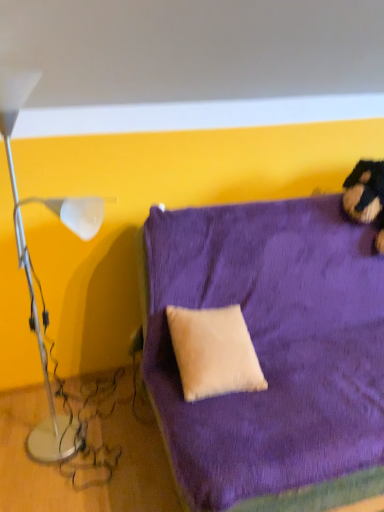
Question: Can beige suede pillow at center be found inside white glossy lamp at left?

Choices:
 (A) no
 (B) yes

Answer: (A)

Question: Can you confirm if white glossy lamp at left is smaller than beige suede pillow at center?

Choices:
 (A) no
 (B) yes

Answer: (A)

Question: Does white glossy lamp at left have a larger size compared to beige suede pillow at center?

Choices:
 (A) yes
 (B) no

Answer: (A)

Question: Does white glossy lamp at left appear on the left side of beige suede pillow at center?

Choices:
 (A) yes
 (B) no

Answer: (A)

Question: Does white glossy lamp at left come in front of beige suede pillow at center?

Choices:
 (A) yes
 (B) no

Answer: (A)

Question: From a real-world perspective, is velvet purple couch at center positioned above or below white glossy lamp at left?

Choices:
 (A) below
 (B) above

Answer: (A)

Question: From the image's perspective, is velvet purple couch at center located above or below white glossy lamp at left?

Choices:
 (A) below
 (B) above

Answer: (A)

Question: Considering the positions of velvet purple couch at center and white glossy lamp at left in the image, is velvet purple couch at center wider or thinner than white glossy lamp at left?

Choices:
 (A) wide
 (B) thin

Answer: (A)

Question: Is velvet purple couch at center inside or outside of white glossy lamp at left?

Choices:
 (A) inside
 (B) outside

Answer: (B)

Question: Is point (11, 130) closer or farther from the camera than point (289, 473)?

Choices:
 (A) farther
 (B) closer

Answer: (A)

Question: Based on their positions, is white glossy lamp at left located to the left or right of velvet purple couch at center?

Choices:
 (A) right
 (B) left

Answer: (B)

Question: Which is correct: white glossy lamp at left is inside velvet purple couch at center, or outside of it?

Choices:
 (A) inside
 (B) outside

Answer: (B)

Question: From a real-world perspective, is white glossy lamp at left physically located above or below velvet purple couch at center?

Choices:
 (A) above
 (B) below

Answer: (A)

Question: Does point (18, 97) appear closer or farther from the camera than point (205, 309)?

Choices:
 (A) farther
 (B) closer

Answer: (B)

Question: In terms of width, does white glossy lamp at left look wider or thinner when compared to beige suede pillow at center?

Choices:
 (A) wide
 (B) thin

Answer: (A)